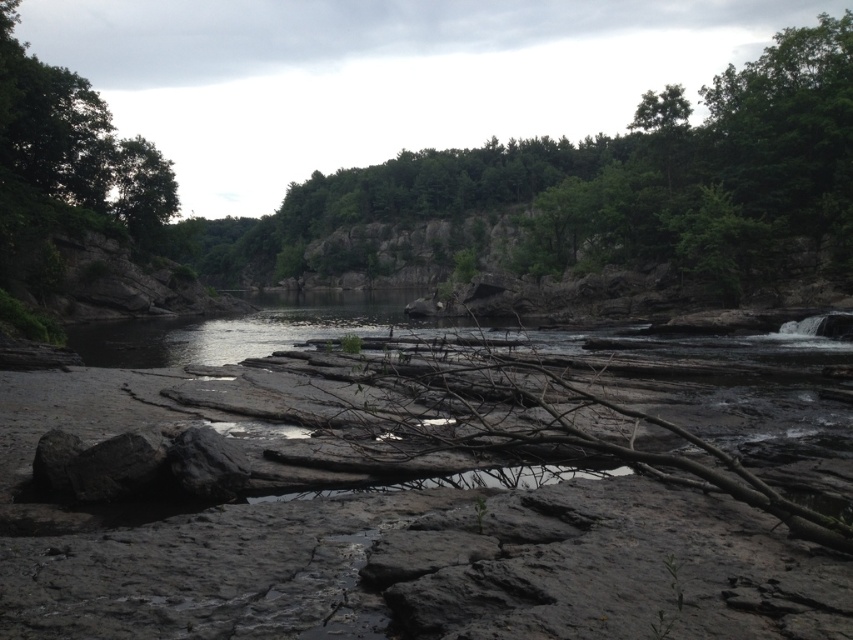
Is point (843, 92) behind point (36, 93)?

That is False.

Can you confirm if green leafy tree at upper center is positioned above green leafy tree at upper left?

Yes, green leafy tree at upper center is above green leafy tree at upper left.

Does point (779, 52) lie in front of point (25, 115)?

Yes.

Image resolution: width=853 pixels, height=640 pixels. What are the coordinates of `green leafy tree at upper center` in the screenshot? It's located at (590, 173).